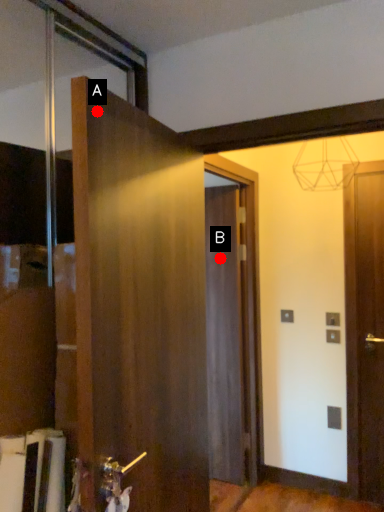
Question: Two points are circled on the image, labeled by A and B beside each circle. Which point is further to the camera?

Choices:
 (A) A is further
 (B) B is further

Answer: (B)